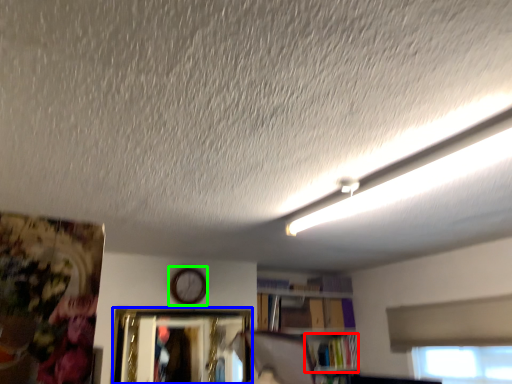
Question: Estimate the real-world distances between objects in this image. Which object is farther from book (highlighted by a red box), picture frame (highlighted by a blue box) or clock (highlighted by a green box)?

Choices:
 (A) picture frame
 (B) clock

Answer: (B)